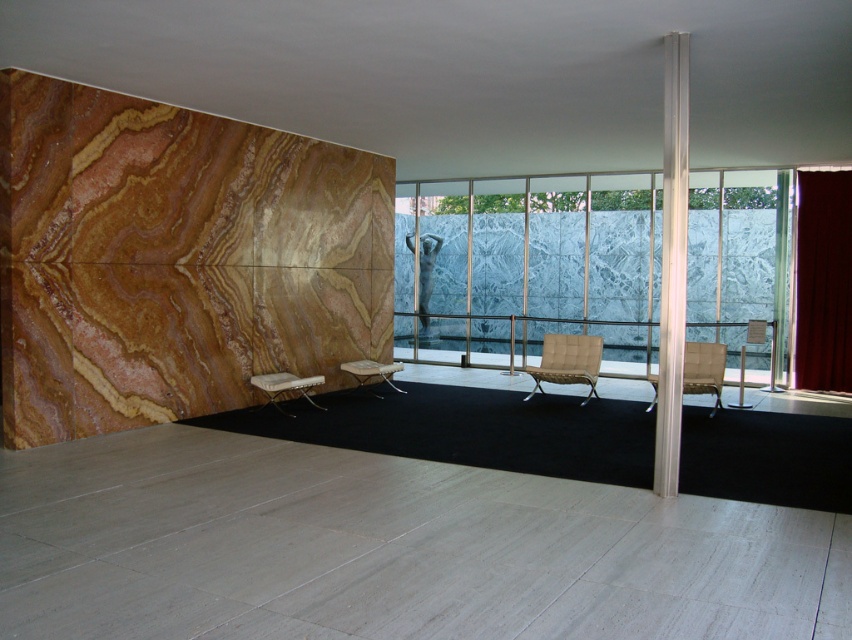
Who is more distant from viewer, (845, 268) or (360, 364)?

The point (845, 268) is more distant.

Can you confirm if dark red velvet curtain at right is smaller than white woven fabric armchair at center?

Incorrect, dark red velvet curtain at right is not smaller in size than white woven fabric armchair at center.

Between point (838, 259) and point (369, 362), which one is positioned in front?

Point (369, 362)

Locate an element on the screen. The width and height of the screenshot is (852, 640). dark red velvet curtain at right is located at coordinates point(822,282).

Is white glossy pillar at right positioned behind white leather armchair at center?

No.

Is white glossy pillar at right taller than white leather armchair at center?

Yes.

Is point (677, 166) closer to camera compared to point (311, 380)?

Yes, point (677, 166) is in front of point (311, 380).

The width and height of the screenshot is (852, 640). Find the location of `white glossy pillar at right`. white glossy pillar at right is located at coordinates (672, 262).

Consider the image. Which of these two, white glossy pillar at right or light beige fabric armchair at right, stands taller?

white glossy pillar at right is taller.

Can you confirm if white glossy pillar at right is bigger than light beige fabric armchair at right?

No.

Does point (661, 442) lie in front of point (654, 397)?

That is True.

Where is `white glossy pillar at right`? The width and height of the screenshot is (852, 640). white glossy pillar at right is located at coordinates (672, 262).